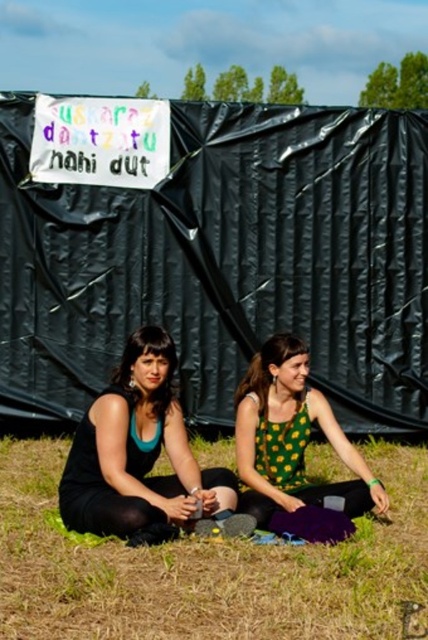
Is black matte tank top at center below green dotted tank top at center?

Indeed, black matte tank top at center is positioned under green dotted tank top at center.

This screenshot has height=640, width=428. I want to click on black matte tank top at center, so click(140, 456).

You are a GUI agent. You are given a task and a screenshot of the screen. Output one action in this format:
    pyautogui.click(x=<x>, y=<y>)
    Task: Click on the black matte tank top at center
    The height and width of the screenshot is (640, 428).
    Given the screenshot: What is the action you would take?
    pyautogui.click(x=140, y=456)

Which of these two, green grass at lower center or black matte tank top at center, stands taller?

black matte tank top at center is taller.

How much distance is there between green grass at lower center and black matte tank top at center?

green grass at lower center is 20.88 inches away from black matte tank top at center.

Which is behind, point (240, 584) or point (140, 449)?

Positioned behind is point (140, 449).

Identify the location of green grass at lower center. (207, 568).

Is matte black tank top at center to the right of green dotted dress at center from the viewer's perspective?

No, matte black tank top at center is not to the right of green dotted dress at center.

I want to click on matte black tank top at center, so click(x=136, y=360).

At what (x,y) coordinates should I click in order to perform the action: click on matte black tank top at center. Please return your answer as a coordinate pair (x, y). Image resolution: width=428 pixels, height=640 pixels. Looking at the image, I should click on (136, 360).